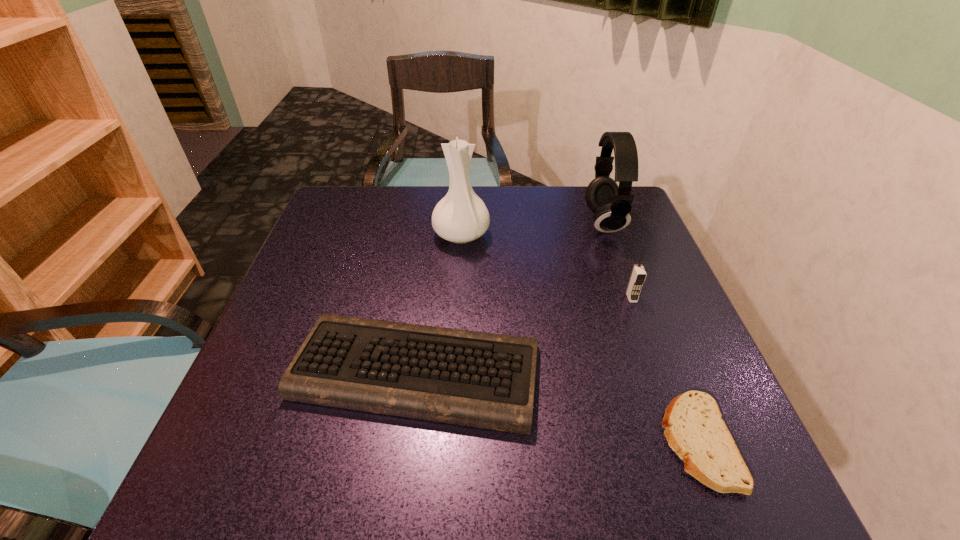
Find the location of a particular element. free spot that satisfies the following two spatial constraints: 1. on the back side of the pita bread; 2. on the ear cups of the earphone is located at coordinates (612, 222).

The image size is (960, 540). I want to click on vacant area in the image that satisfies the following two spatial constraints: 1. on the front side of the second shortest object; 2. on the left side of the shortest object, so click(x=408, y=443).

What are the coordinates of `free location that satisfies the following two spatial constraints: 1. on the ear cups of the earphone; 2. on the back side of the pita bread` in the screenshot? It's located at (684, 443).

I want to click on free space that satisfies the following two spatial constraints: 1. on the front side of the pita bread; 2. on the left side of the fourth tallest object, so click(x=408, y=443).